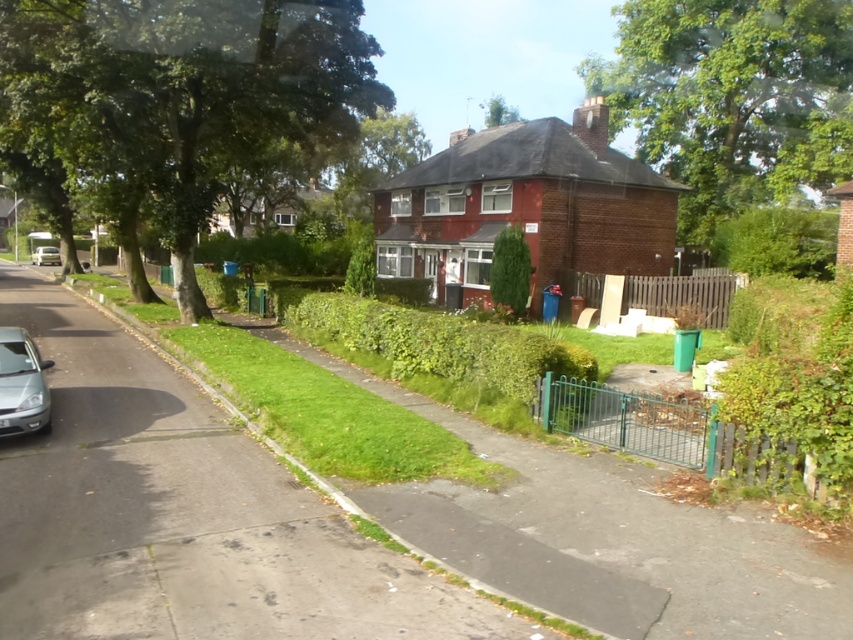
Between point (0, 424) and point (47, 252), which one is positioned behind?

The point (47, 252) is behind.

Who is more forward, (9, 340) or (33, 252)?

Point (9, 340) is more forward.

Is point (24, 371) farther from viewer compared to point (59, 256)?

No.

The image size is (853, 640). I want to click on silver metallic car at lower left, so tap(22, 385).